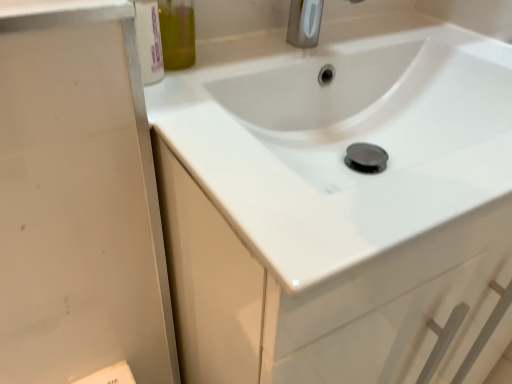
Question: Could you tell me if satin nickel faucet at upper center is turned towards olive green glass bottle at upper left?

Choices:
 (A) no
 (B) yes

Answer: (A)

Question: From the image's perspective, is satin nickel faucet at upper center located beneath olive green glass bottle at upper left?

Choices:
 (A) no
 (B) yes

Answer: (A)

Question: Is satin nickel faucet at upper center at the right side of olive green glass bottle at upper left?

Choices:
 (A) no
 (B) yes

Answer: (B)

Question: Is satin nickel faucet at upper center facing away from olive green glass bottle at upper left?

Choices:
 (A) no
 (B) yes

Answer: (A)

Question: Can olive green glass bottle at upper left be found inside satin nickel faucet at upper center?

Choices:
 (A) yes
 (B) no

Answer: (B)

Question: Is olive green glass bottle at upper left wider or thinner than white glossy sink at center?

Choices:
 (A) thin
 (B) wide

Answer: (A)

Question: Is olive green glass bottle at upper left inside or outside of white glossy sink at center?

Choices:
 (A) inside
 (B) outside

Answer: (B)

Question: Relative to white glossy sink at center, is olive green glass bottle at upper left in front or behind?

Choices:
 (A) behind
 (B) front

Answer: (A)

Question: Does point (169, 51) appear closer or farther from the camera than point (395, 134)?

Choices:
 (A) closer
 (B) farther

Answer: (A)

Question: In terms of width, does satin nickel faucet at upper center look wider or thinner when compared to olive green glass bottle at upper left?

Choices:
 (A) wide
 (B) thin

Answer: (A)

Question: Considering the positions of point tap(309, 16) and point tap(167, 11), is point tap(309, 16) closer or farther from the camera than point tap(167, 11)?

Choices:
 (A) farther
 (B) closer

Answer: (A)

Question: From the image's perspective, relative to olive green glass bottle at upper left, is satin nickel faucet at upper center above or below?

Choices:
 (A) above
 (B) below

Answer: (A)

Question: From a real-world perspective, relative to olive green glass bottle at upper left, is satin nickel faucet at upper center vertically above or below?

Choices:
 (A) above
 (B) below

Answer: (B)

Question: Is satin nickel faucet at upper center taller or shorter than white glossy sink at center?

Choices:
 (A) short
 (B) tall

Answer: (A)

Question: From the image's perspective, relative to white glossy sink at center, is satin nickel faucet at upper center above or below?

Choices:
 (A) below
 (B) above

Answer: (B)